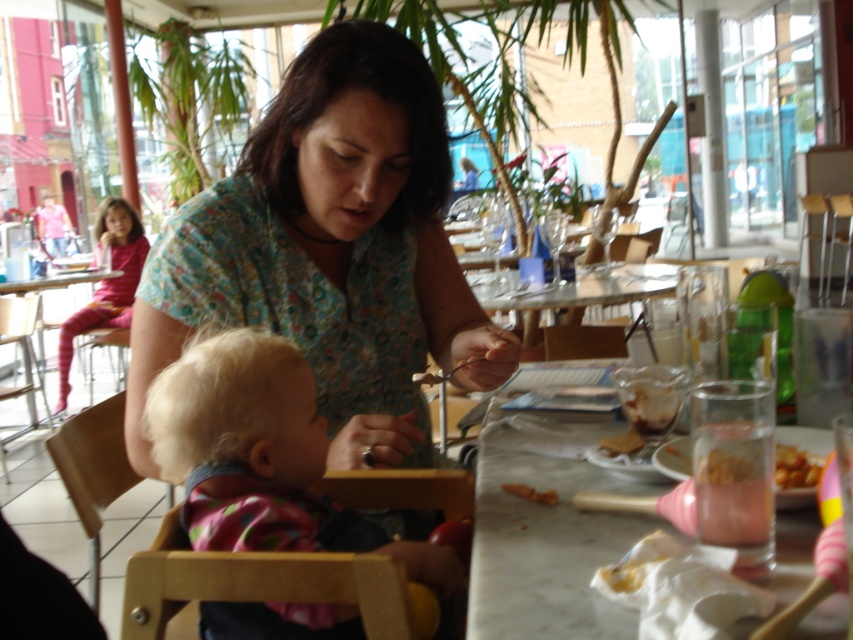
Question: Is blonde hair at center to the left of golden crispy fries at table right from the viewer's perspective?

Choices:
 (A) no
 (B) yes

Answer: (B)

Question: Is floral fabric shirt at center smaller than orange matte carrot at center?

Choices:
 (A) yes
 (B) no

Answer: (B)

Question: Which of these objects is positioned farthest from the blonde hair at center?

Choices:
 (A) wooden chair at lower left
 (B) wooden high chair at lower left
 (C) clear glass table at center
 (D) marble table at lower right

Answer: (B)

Question: Which object appears closest to the camera in this image?

Choices:
 (A) floral fabric shirt at center
 (B) wooden high chair at lower left

Answer: (A)

Question: Is the position of wooden chair at lower left more distant than that of wooden high chair at lower left?

Choices:
 (A) no
 (B) yes

Answer: (A)

Question: Which of these objects is positioned farthest from the marble table at lower right?

Choices:
 (A) floral fabric shirt at center
 (B) blonde hair at center

Answer: (A)